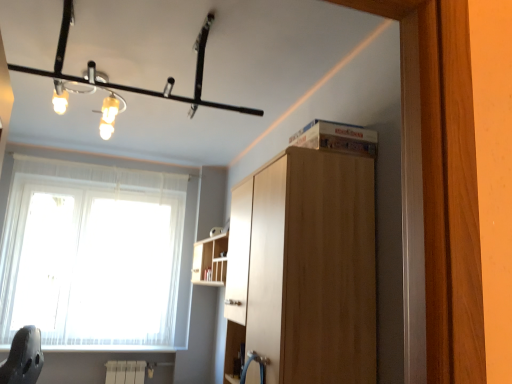
Question: Is matte black light fixture at upper center bigger or smaller than white sheer curtain at left?

Choices:
 (A) small
 (B) big

Answer: (A)

Question: Does point (105, 110) appear closer or farther from the camera than point (101, 261)?

Choices:
 (A) farther
 (B) closer

Answer: (B)

Question: Estimate the real-world distances between objects in this image. Which object is farther from the light brown wood cabinet at upper center?

Choices:
 (A) wooden shelf at upper center
 (B) white sheer curtain at left
 (C) matte black light fixture at upper center

Answer: (B)

Question: Which object is the closest to the white sheer curtain at left?

Choices:
 (A) matte black light fixture at upper center
 (B) light brown wood cabinet at upper center
 (C) wooden shelf at upper center

Answer: (C)